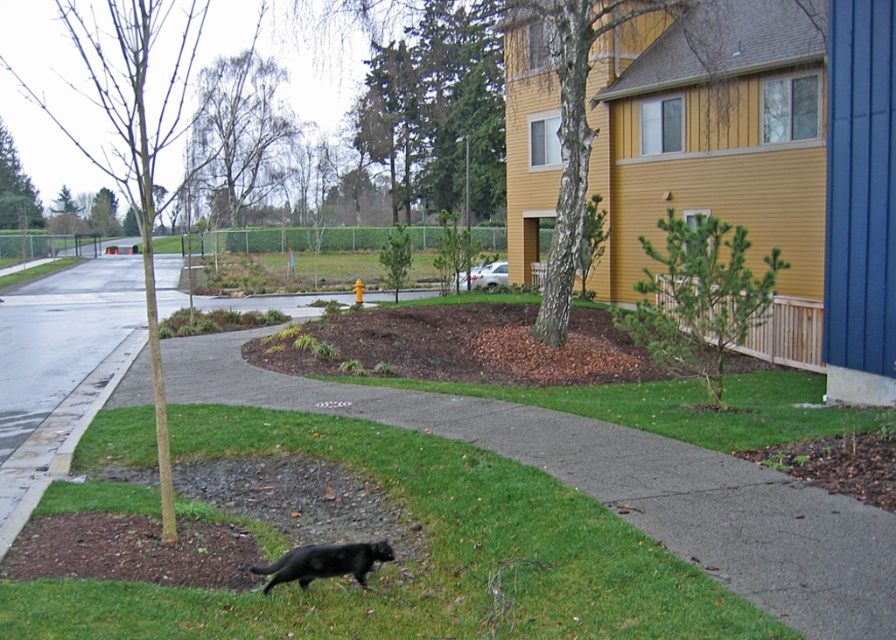
Question: Which of the following is the farthest from the observer?

Choices:
 (A) (601, 634)
 (B) (621, 333)

Answer: (B)

Question: Can you confirm if green grass at lower center is positioned below brown mulch at center?

Choices:
 (A) no
 (B) yes

Answer: (B)

Question: Does brown mulch at center appear on the right side of black furry cat at lower center?

Choices:
 (A) yes
 (B) no

Answer: (A)

Question: Which point is farther from the camera taking this photo?

Choices:
 (A) (x=59, y=506)
 (B) (x=304, y=563)

Answer: (A)

Question: In this image, where is green grass at lower center located relative to brown mulch at center?

Choices:
 (A) right
 (B) left

Answer: (B)

Question: Which object is farther from the camera taking this photo?

Choices:
 (A) green grass at lower center
 (B) black furry cat at lower center
 (C) brown mulch at center

Answer: (C)